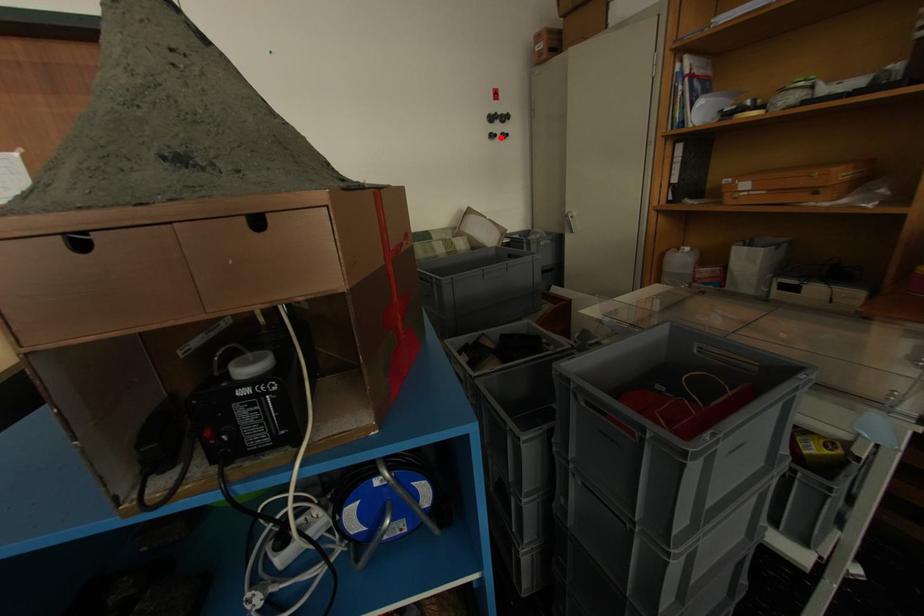
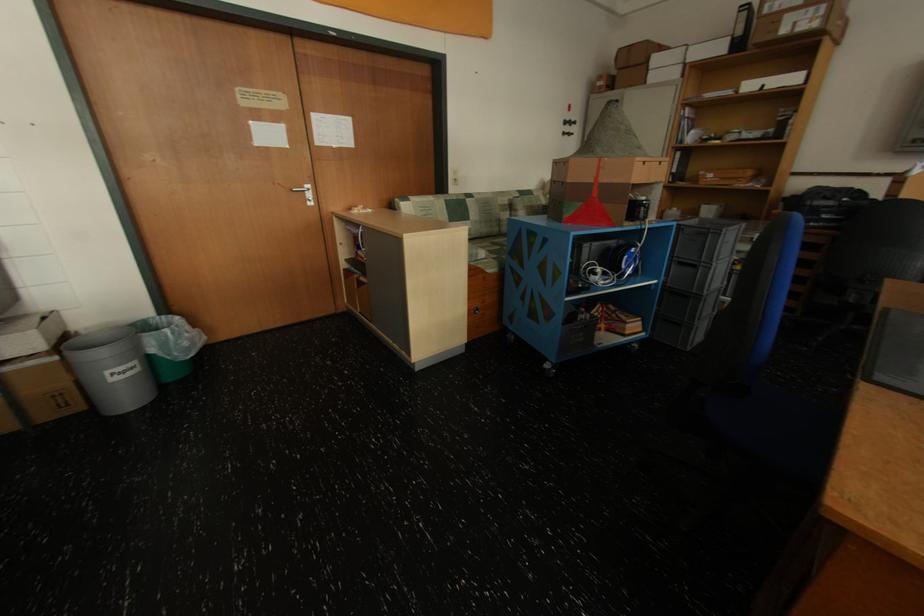
Question: A red point is marked in image1. In image2, is the corresponding 3D point closer to the camera or farther? Reply with the corresponding letter.

Choices:
 (A) The corresponding 3D point is closer.
 (B) The corresponding 3D point is farther.

Answer: (A)